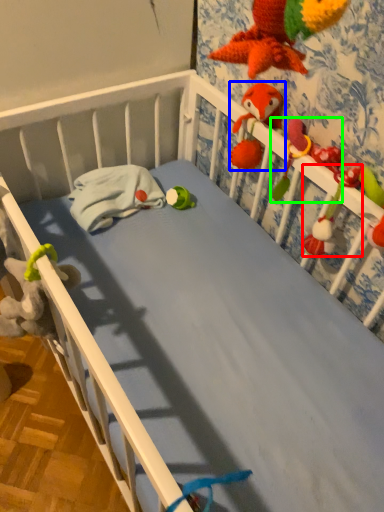
Question: Estimate the real-world distances between objects in this image. Which object is closer to toy (highlighted by a red box), toy (highlighted by a blue box) or parrot (highlighted by a green box)?

Choices:
 (A) toy
 (B) parrot

Answer: (B)